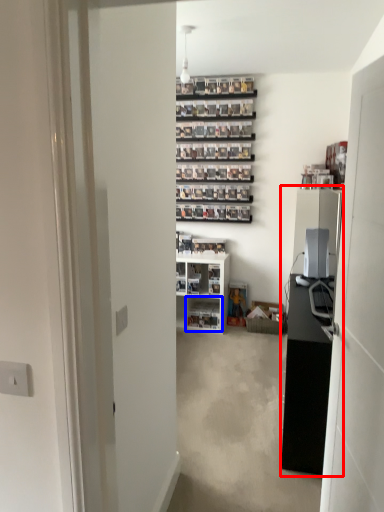
Question: Which object appears closest to the camera in this image, entertainment center (highlighted by a red box) or shelf (highlighted by a blue box)?

Choices:
 (A) entertainment center
 (B) shelf

Answer: (A)